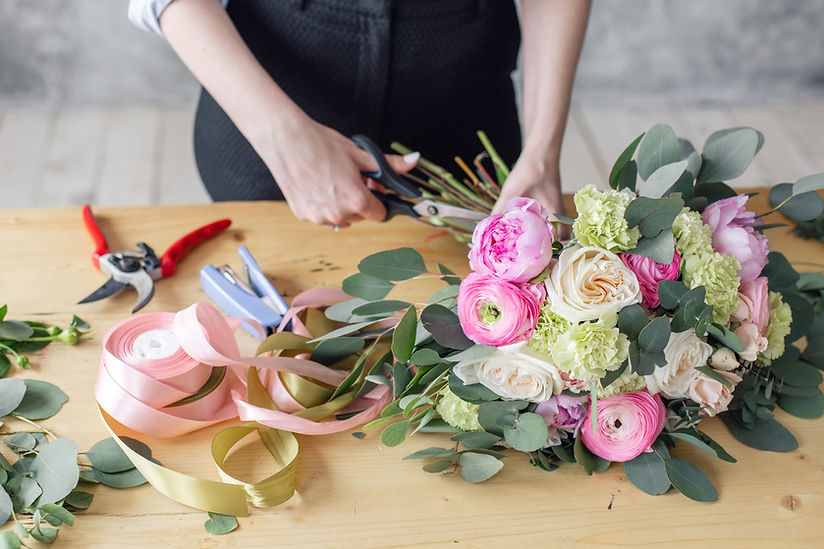
You are a GUI agent. You are given a task and a screenshot of the screen. Output one action in this format:
    pyautogui.click(x=<x>, y=<y>)
    Task: Click on the stapler
    This screenshot has height=549, width=824.
    Given the screenshot: What is the action you would take?
    pyautogui.click(x=247, y=302)